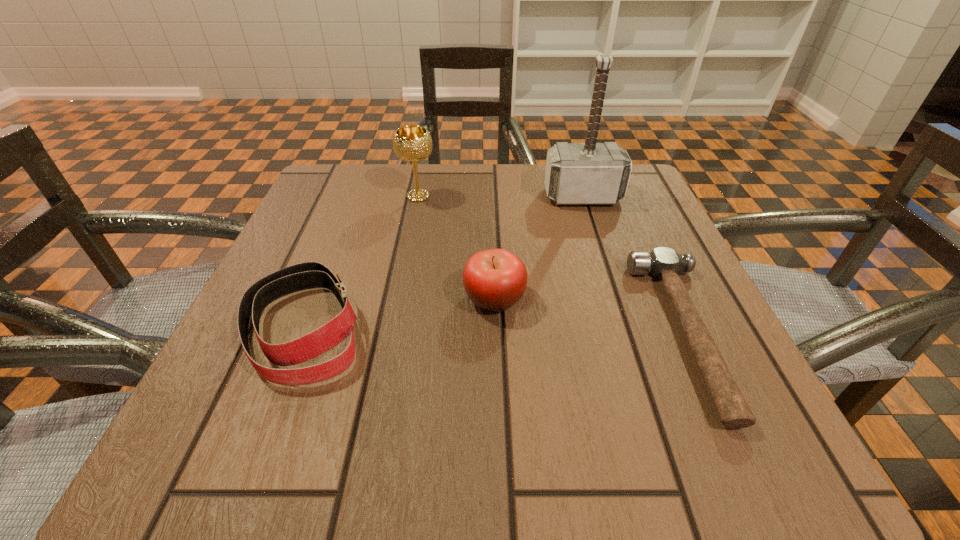
Identify the location of blank space located for striking with the head of the farther hammer. (601, 254).

The width and height of the screenshot is (960, 540). I want to click on vacant space located 0.320m on the right of the fourth object from right to left, so click(x=582, y=196).

This screenshot has height=540, width=960. Find the location of `vacant area situated on the back of the apple`. vacant area situated on the back of the apple is located at coordinates (490, 169).

You are a GUI agent. You are given a task and a screenshot of the screen. Output one action in this format:
    pyautogui.click(x=<x>, y=<y>)
    Task: Click on the free space located on the right of the dog collar
    This screenshot has height=540, width=960.
    Given the screenshot: What is the action you would take?
    pyautogui.click(x=539, y=327)

Where is `free location located on the striking face of the nearer hammer`? free location located on the striking face of the nearer hammer is located at coordinates (402, 333).

The height and width of the screenshot is (540, 960). In order to click on free space located 0.160m on the striking face of the nearer hammer in this screenshot , I will do `click(546, 333)`.

I want to click on free space located on the striking face of the nearer hammer, so click(x=565, y=333).

Locate an element on the screen. The width and height of the screenshot is (960, 540). hammer located in the far edge section of the desktop is located at coordinates (590, 173).

Where is `chalice at the far edge`? chalice at the far edge is located at coordinates (412, 143).

You are a GUI agent. You are given a task and a screenshot of the screen. Output one action in this format:
    pyautogui.click(x=<x>, y=<y>)
    Task: Click on the object situated at the near edge
    This screenshot has height=540, width=960.
    Given the screenshot: What is the action you would take?
    pyautogui.click(x=664, y=263)